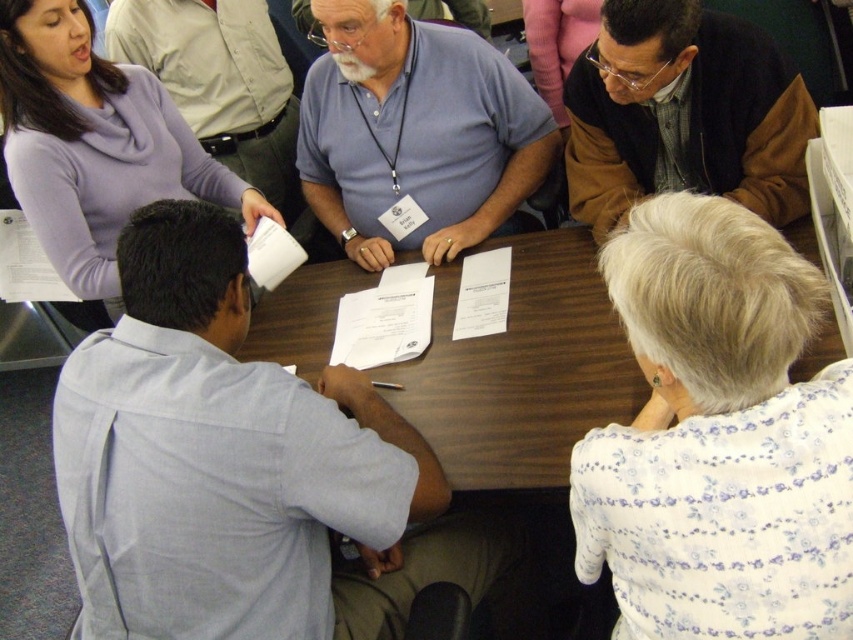
Question: Which object is closer to the camera taking this photo?

Choices:
 (A) dark brown jacket at upper right
 (B) matte blue shirt at center

Answer: (A)

Question: Which of these objects is positioned farthest from the light blue shirt at center?

Choices:
 (A) wooden table at center
 (B) matte gray shirt at upper left

Answer: (B)

Question: Which of the following is the closest to the observer?

Choices:
 (A) click(537, 406)
 (B) click(100, 516)
 (C) click(231, 51)

Answer: (B)

Question: Is wooden table at center positioned at the back of matte purple sweater at upper left?

Choices:
 (A) no
 (B) yes

Answer: (A)

Question: Observing the image, what is the correct spatial positioning of matte blue shirt at center in reference to matte gray shirt at upper left?

Choices:
 (A) above
 (B) below

Answer: (B)

Question: Can you confirm if matte purple sweater at upper left is positioned to the left of matte gray shirt at upper left?

Choices:
 (A) yes
 (B) no

Answer: (A)